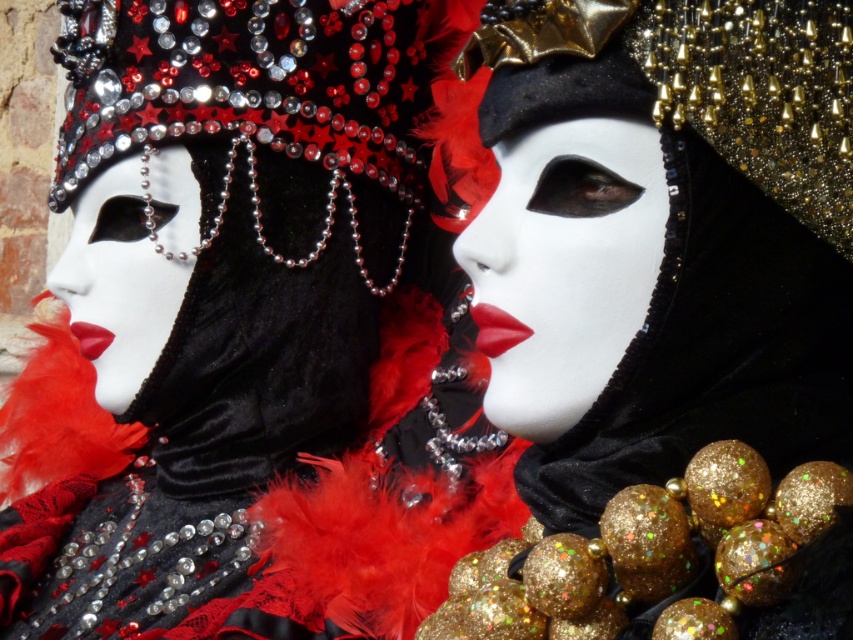
Question: Is velvet mask at center smaller than matte black mask at center?

Choices:
 (A) no
 (B) yes

Answer: (A)

Question: Which point is farther to the camera?

Choices:
 (A) matte black mask at center
 (B) velvet mask at center

Answer: (B)

Question: Can you confirm if velvet mask at center is positioned to the right of matte black mask at center?

Choices:
 (A) yes
 (B) no

Answer: (B)

Question: Which of the following is the farthest from the observer?

Choices:
 (A) velvet mask at center
 (B) matte black mask at center

Answer: (A)

Question: Is velvet mask at center wider than matte black mask at center?

Choices:
 (A) no
 (B) yes

Answer: (B)